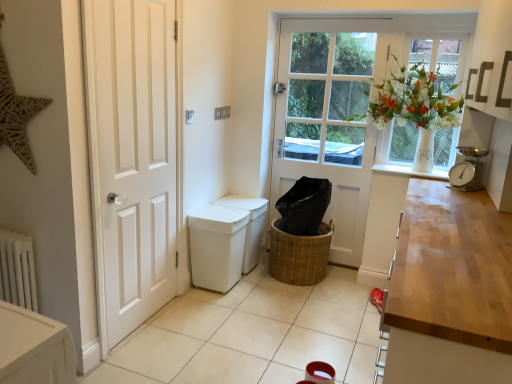
Identify the location of vacant area that lies in front of white glossy door at left, which is counted as the first door, starting from the front. The height and width of the screenshot is (384, 512). (151, 362).